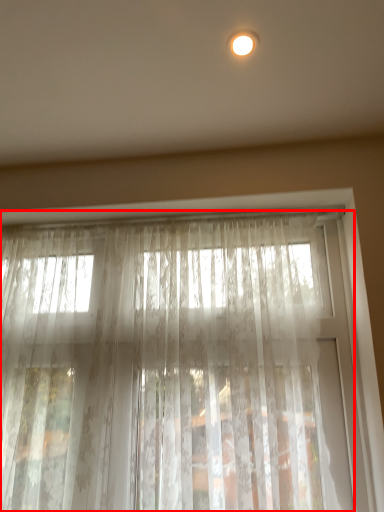
Question: Where is curtain (annotated by the red box) located in relation to lighting in the image?

Choices:
 (A) right
 (B) left

Answer: (B)